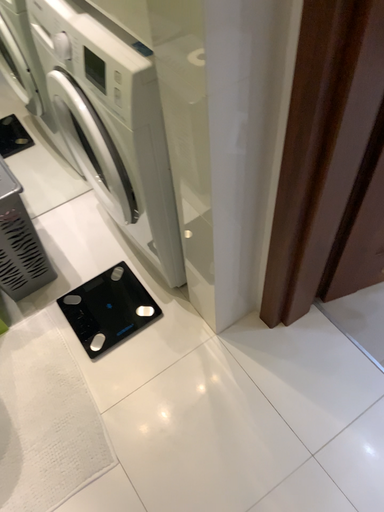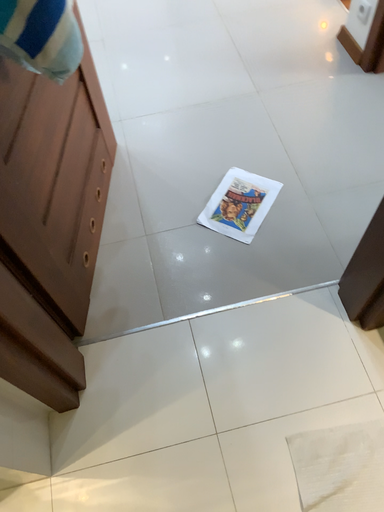
Question: How did the camera likely rotate when shooting the video?

Choices:
 (A) rotated left
 (B) rotated right

Answer: (B)